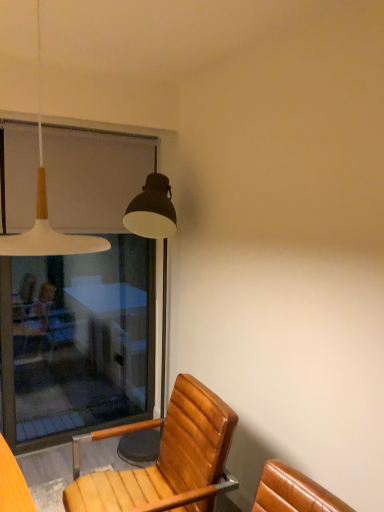
Question: Visually, is transparent glass screen door at left positioned to the left or to the right of wooden chair at lower center?

Choices:
 (A) right
 (B) left

Answer: (B)

Question: Considering the positions of transparent glass screen door at left and wooden chair at lower center in the image, is transparent glass screen door at left bigger or smaller than wooden chair at lower center?

Choices:
 (A) big
 (B) small

Answer: (B)

Question: Based on their relative distances, which object is nearer to the transparent glass screen door at left?

Choices:
 (A) wooden chair at lower center
 (B) white matte pendant light at upper left

Answer: (A)

Question: Which object is positioned closest to the white matte pendant light at upper left?

Choices:
 (A) wooden chair at lower center
 (B) transparent glass screen door at left

Answer: (A)